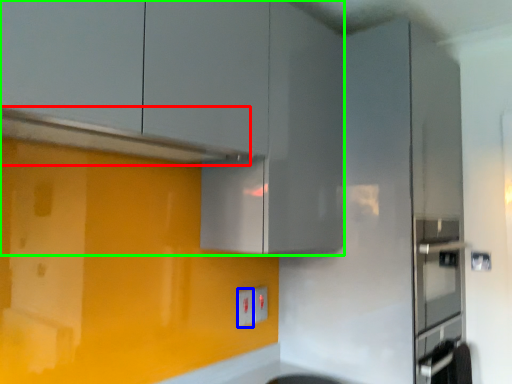
Question: Based on their relative distances, which object is nearer to exhaust hood (highlighted by a red box)? Choose from electric outlet (highlighted by a blue box) and cabinetry (highlighted by a green box).

Choices:
 (A) electric outlet
 (B) cabinetry

Answer: (B)